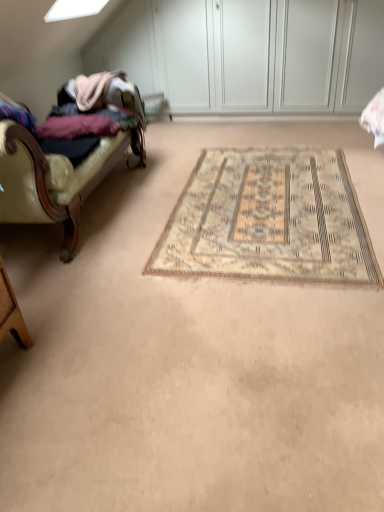
The width and height of the screenshot is (384, 512). What do you see at coordinates (66, 163) in the screenshot?
I see `leather couch at left` at bounding box center [66, 163].

At what (x,y) coordinates should I click in order to perform the action: click on leather couch at left. Please return your answer as a coordinate pair (x, y). Looking at the image, I should click on (66, 163).

What do you see at coordinates (268, 220) in the screenshot? The image size is (384, 512). I see `beige woven rug at center` at bounding box center [268, 220].

The image size is (384, 512). What are the coordinates of `beige woven rug at center` in the screenshot? It's located at (268, 220).

Where is `leather couch at left`? This screenshot has width=384, height=512. leather couch at left is located at coordinates (66, 163).

Is leather couch at left to the right of beige woven rug at center from the viewer's perspective?

In fact, leather couch at left is to the left of beige woven rug at center.

Is leather couch at left in front of beige woven rug at center?

Yes.

Which is nearer, (x=25, y=198) or (x=233, y=199)?

Point (x=25, y=198) is positioned closer to the camera compared to point (x=233, y=199).

From the image's perspective, would you say leather couch at left is shown under beige woven rug at center?

No.

From a real-world perspective, is leather couch at left positioned under beige woven rug at center based on gravity?

Incorrect, from a real-world perspective, leather couch at left is higher than beige woven rug at center.

Which object is wider, leather couch at left or beige woven rug at center?

beige woven rug at center is wider.

From the picture: Considering the sizes of leather couch at left and beige woven rug at center in the image, is leather couch at left taller or shorter than beige woven rug at center?

leather couch at left is taller than beige woven rug at center.

In the scene shown: Considering the sizes of objects leather couch at left and beige woven rug at center in the image provided, who is smaller, leather couch at left or beige woven rug at center?

Smaller between the two is beige woven rug at center.

Can we say leather couch at left lies outside beige woven rug at center?

leather couch at left is positioned outside beige woven rug at center.

Are leather couch at left and beige woven rug at center located far from each other?

leather couch at left is near beige woven rug at center, not far away.

Is leather couch at left facing towards beige woven rug at center?

Yes, leather couch at left is aimed at beige woven rug at center.

Can you tell me how much leather couch at left and beige woven rug at center differ in facing direction?

The angle between the facing direction of leather couch at left and the facing direction of beige woven rug at center is 92.5 degrees.

The width and height of the screenshot is (384, 512). Find the location of `mat that appears below the leather couch at left (from a real-world perspective)`. mat that appears below the leather couch at left (from a real-world perspective) is located at coordinates pyautogui.click(x=268, y=220).

Considering the positions of objects beige woven rug at center and leather couch at left in the image provided, who is more to the left, beige woven rug at center or leather couch at left?

Positioned to the left is leather couch at left.

Which object is closer to the camera taking this photo, beige woven rug at center or leather couch at left?

Positioned in front is leather couch at left.

Does point (289, 213) appear closer or farther from the camera than point (114, 85)?

Point (289, 213).

From the image's perspective, who appears lower, beige woven rug at center or leather couch at left?

beige woven rug at center appears lower in the image.

From a real-world perspective, which object stands above the other?

In real-world perspective, leather couch at left is above.

Can you confirm if beige woven rug at center is thinner than leather couch at left?

Incorrect, the width of beige woven rug at center is not less than that of leather couch at left.

From the picture: Between beige woven rug at center and leather couch at left, which one has less height?

Standing shorter between the two is beige woven rug at center.

Considering the relative sizes of beige woven rug at center and leather couch at left in the image provided, is beige woven rug at center smaller than leather couch at left?

Indeed, beige woven rug at center has a smaller size compared to leather couch at left.

Is leather couch at left inside beige woven rug at center?

That's incorrect, leather couch at left is not inside beige woven rug at center.

Is beige woven rug at center far away from leather couch at left?

beige woven rug at center is actually quite close to leather couch at left.

Is beige woven rug at center turned away from leather couch at left?

No, beige woven rug at center's orientation is not away from leather couch at left.

The height and width of the screenshot is (512, 384). In order to click on studio couch that is in front of the beige woven rug at center in this screenshot , I will do `click(66, 163)`.

Identify the location of studio couch located on the left of beige woven rug at center. [x=66, y=163].

At what (x,y) coordinates should I click in order to perform the action: click on studio couch above the beige woven rug at center (from the image's perspective). Please return your answer as a coordinate pair (x, y). Looking at the image, I should click on (66, 163).